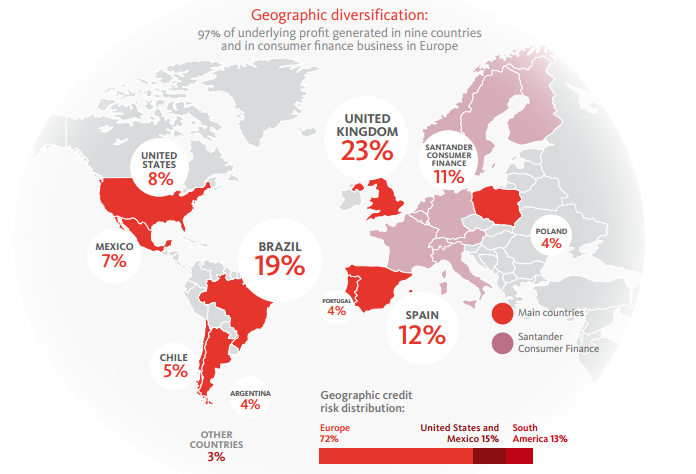
Find the location of a particular element. The height and width of the screenshot is (474, 696). globe is located at coordinates 617,275.